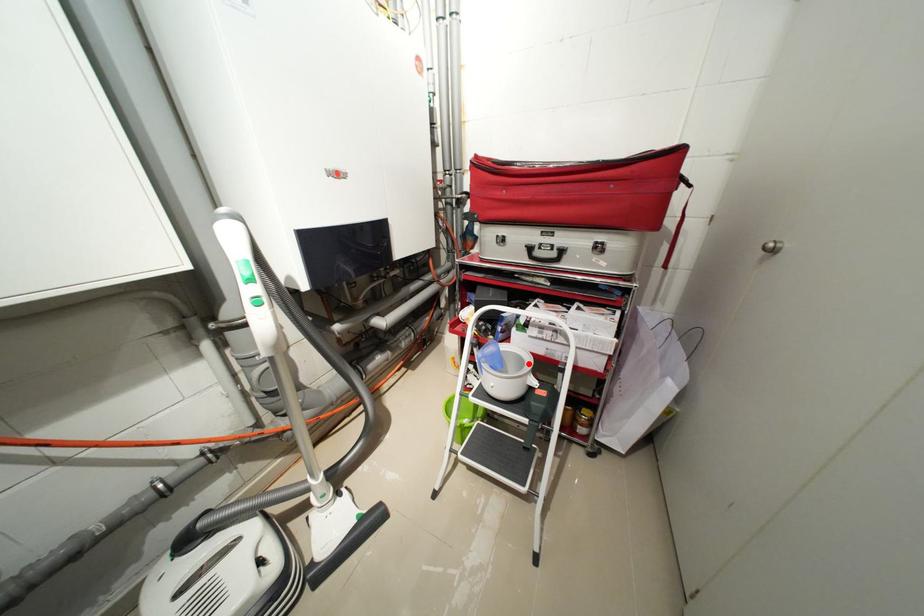
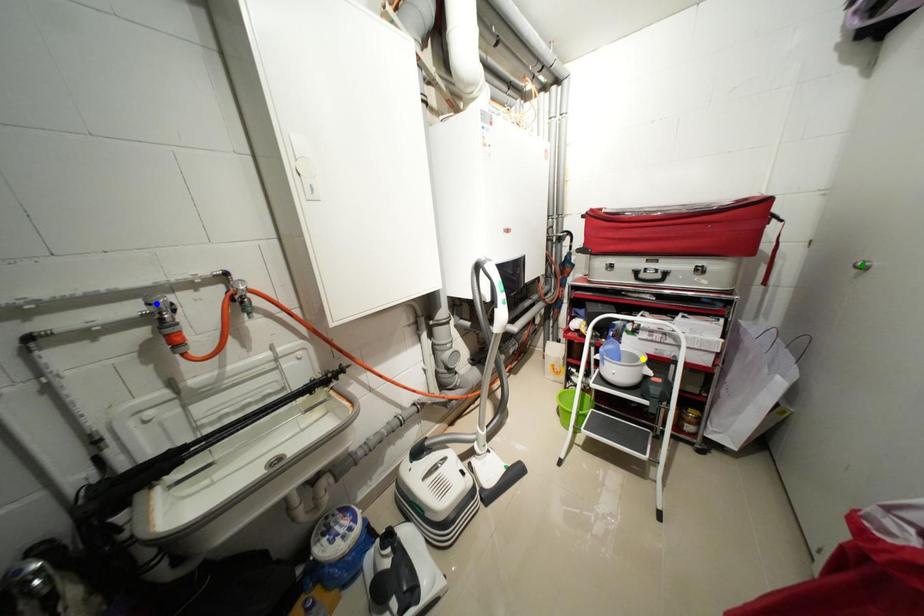
Question: I am providing you with two images of the same scene from different viewpoints. A red point is marked on the first image. You are given multiple points on the second image. In image 2, which mark is for the same physical point as the one in image 1?

Choices:
 (A) blue point
 (B) yellow point
 (C) green point

Answer: (B)